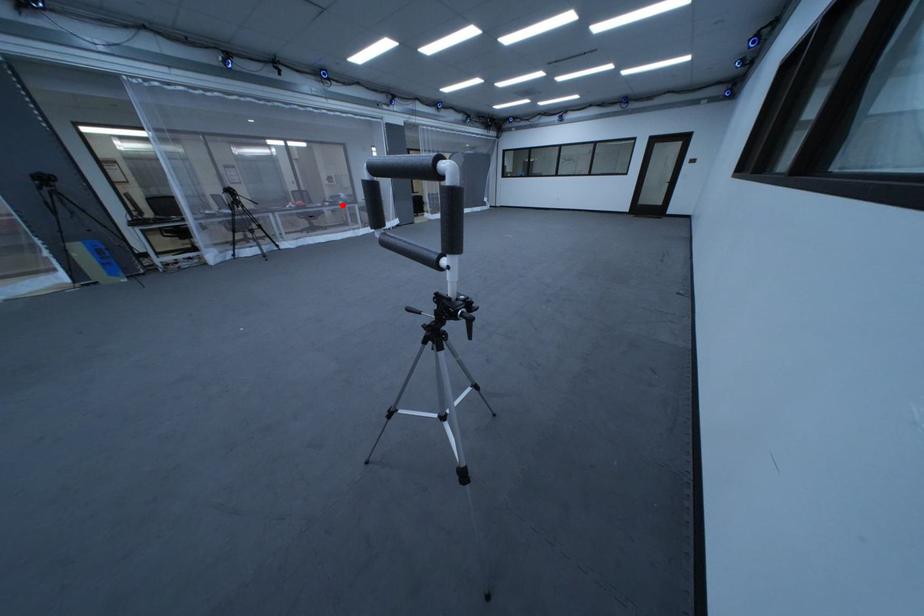
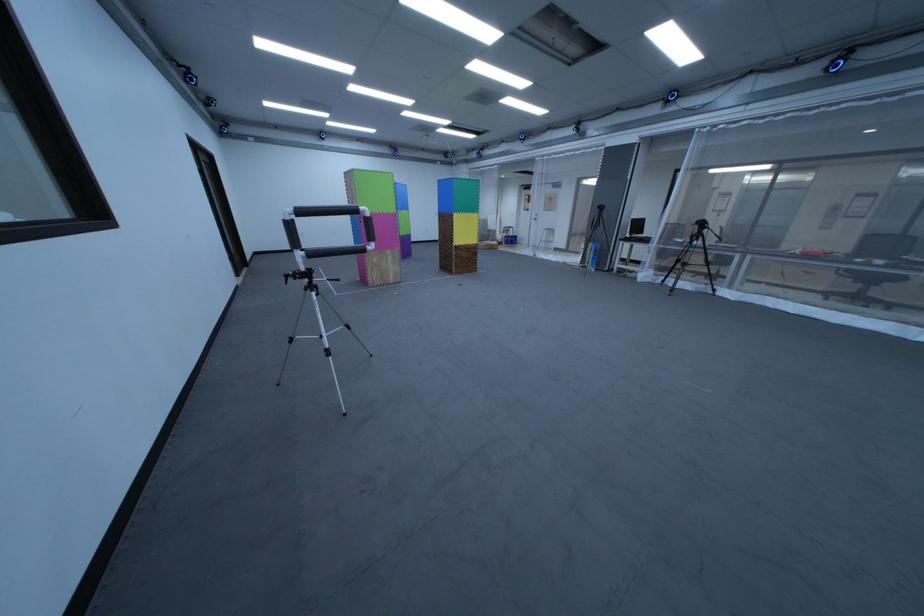
In the second image, find the point that corresponds to the highlighted location in the first image.

(895, 262)